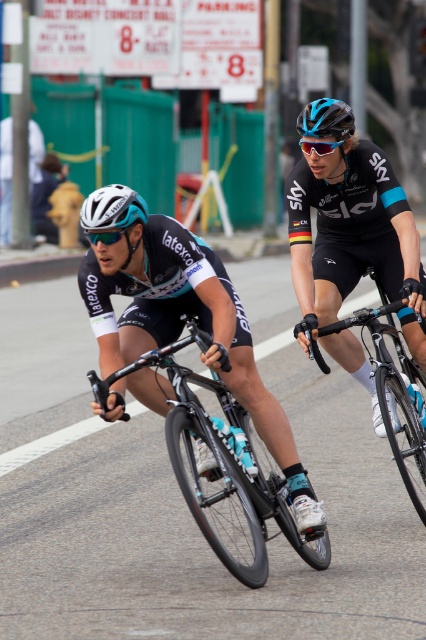
Question: From the image, what is the correct spatial relationship of matte black bicycle at center in relation to blue matte bicycle helmet at upper center?

Choices:
 (A) above
 (B) below

Answer: (B)

Question: Which of the following is the farthest from the observer?

Choices:
 (A) (103, 211)
 (B) (357, 172)
 (C) (261, 461)
 (D) (402, 406)

Answer: (C)

Question: Which is nearer to the shiny black frame at center?

Choices:
 (A) blue matte bicycle helmet at upper center
 (B) matte black bicycle at center
 (C) white matte bicycle helmet at left
 (D) shiny black bicycle at center

Answer: (B)

Question: Does shiny black frame at center appear on the right side of white matte bicycle helmet at left?

Choices:
 (A) no
 (B) yes

Answer: (B)

Question: Does shiny black bicycle at center come in front of shiny black frame at center?

Choices:
 (A) yes
 (B) no

Answer: (A)

Question: Which point is closer to the camera?

Choices:
 (A) matte black bicycle at center
 (B) blue matte bicycle helmet at upper center
 (C) shiny black bicycle at center

Answer: (C)